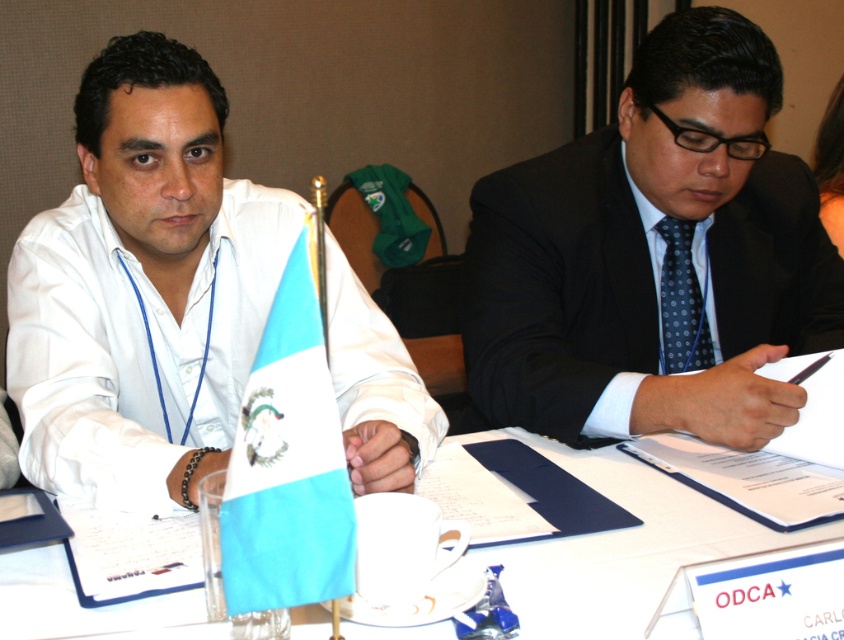
You are standing behind the table in the formal meeting scene. You need to place a name tag on the table between the dark blue suit at center and the blue fabric flag at center. According to their positions, which object should the name tag be closer to?

The dark blue suit at center is to the right of the blue fabric flag at center, so the name tag should be placed closer to the blue fabric flag at center to be between them.

You are organizing a presentation and need to place both the white paper at center and the blue dotted tie at center on a small desk. Which object should you place first if you want to ensure there is enough space for both?

The white paper at center has a larger size compared to the blue dotted tie at center, so you should place the white paper at center first to ensure there is enough space for both.